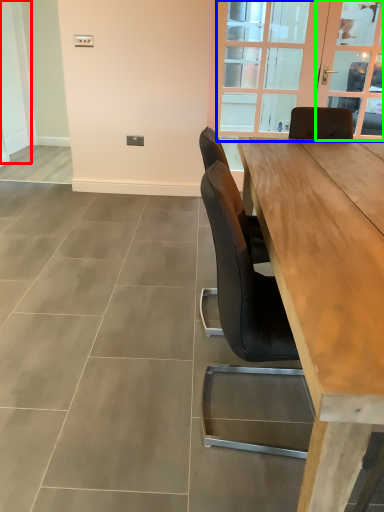
Question: Which is farther away from screen door (highlighted by a red box)? window (highlighted by a blue box) or window screen (highlighted by a green box)?

Choices:
 (A) window
 (B) window screen

Answer: (B)